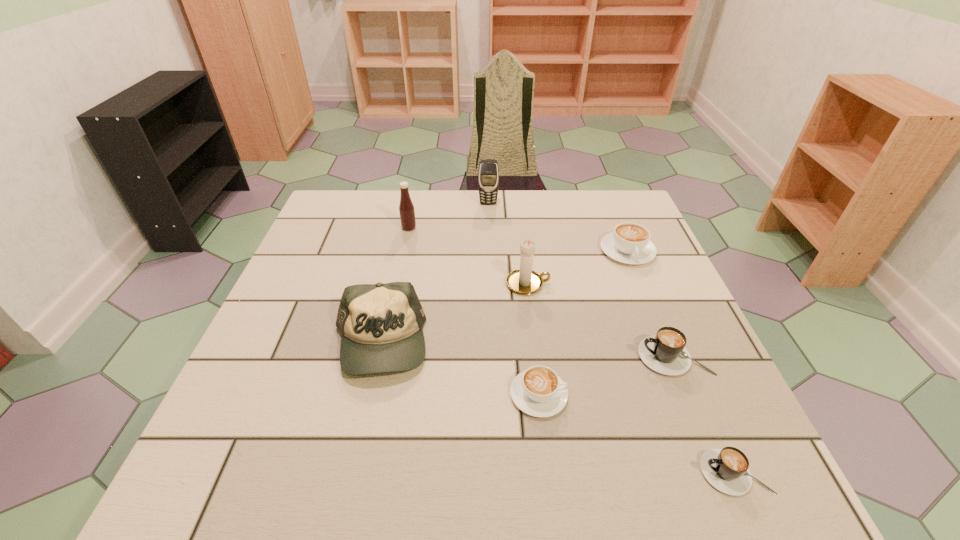
Image resolution: width=960 pixels, height=540 pixels. I want to click on the bigger black cappuccino, so click(665, 352).

In order to click on the nearer white cappuccino in this screenshot , I will do `click(538, 391)`.

At what (x,y) coordinates should I click in order to perform the action: click on the left white cappuccino. Please return your answer as a coordinate pair (x, y). The width and height of the screenshot is (960, 540). Looking at the image, I should click on (538, 391).

Find the location of a particular element. This screenshot has height=540, width=960. the smaller black cappuccino is located at coordinates coord(726,469).

Image resolution: width=960 pixels, height=540 pixels. In order to click on the nearest object in this screenshot , I will do `click(726, 469)`.

Image resolution: width=960 pixels, height=540 pixels. I want to click on free space located 0.360m on the front face of the third object from left to right, so click(491, 285).

Locate an element on the screen. The height and width of the screenshot is (540, 960). vacant space situated 0.050m on the right of the Tabasco sauce is located at coordinates pyautogui.click(x=434, y=228).

This screenshot has width=960, height=540. I want to click on vacant area situated on the handle side of the fifth nearest object, so click(x=587, y=284).

Where is `vacant region located on the front-facing side of the baseball cap`? The width and height of the screenshot is (960, 540). vacant region located on the front-facing side of the baseball cap is located at coordinates (362, 423).

You are a GUI agent. You are given a task and a screenshot of the screen. Output one action in this format:
    pyautogui.click(x=<x>, y=<y>)
    Task: Click on the free spot located 0.090m on the side of the farther white cappuccino with the handle
    
    Given the screenshot: What is the action you would take?
    pyautogui.click(x=644, y=293)